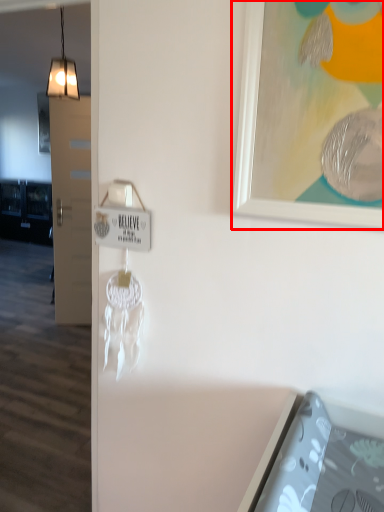
Question: From the image, what is the correct spatial relationship of picture frame (annotated by the red box) in relation to light?

Choices:
 (A) right
 (B) left

Answer: (A)